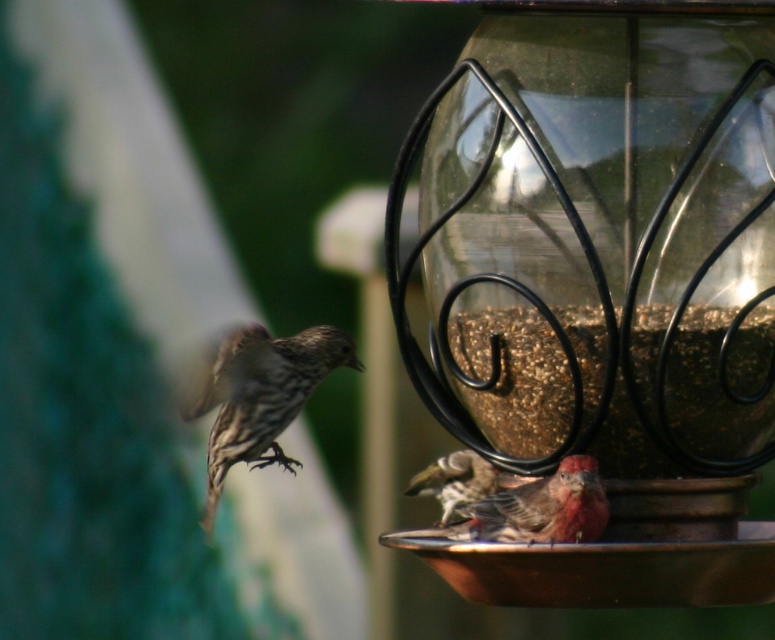
Question: Considering the relative positions of brown textured seeds at center and rusty brown feathers at lower center in the image provided, where is brown textured seeds at center located with respect to rusty brown feathers at lower center?

Choices:
 (A) right
 (B) left

Answer: (A)

Question: Considering the relative positions of brown speckled sparrow at left and brown speckled feathers at lower center in the image provided, where is brown speckled sparrow at left located with respect to brown speckled feathers at lower center?

Choices:
 (A) left
 (B) right

Answer: (A)

Question: Can you confirm if brown speckled sparrow at left is wider than brown speckled feathers at lower center?

Choices:
 (A) yes
 (B) no

Answer: (A)

Question: Which object is the closest to the rusty brown feathers at lower center?

Choices:
 (A) brown textured seeds at center
 (B) brown speckled sparrow at left

Answer: (A)

Question: Which object is the closest to the brown speckled feathers at lower center?

Choices:
 (A) brown textured seeds at center
 (B) translucent glass bird feeder at center

Answer: (A)

Question: Among these points, which one is farthest from the camera?

Choices:
 (A) (643, 195)
 (B) (553, 531)

Answer: (B)